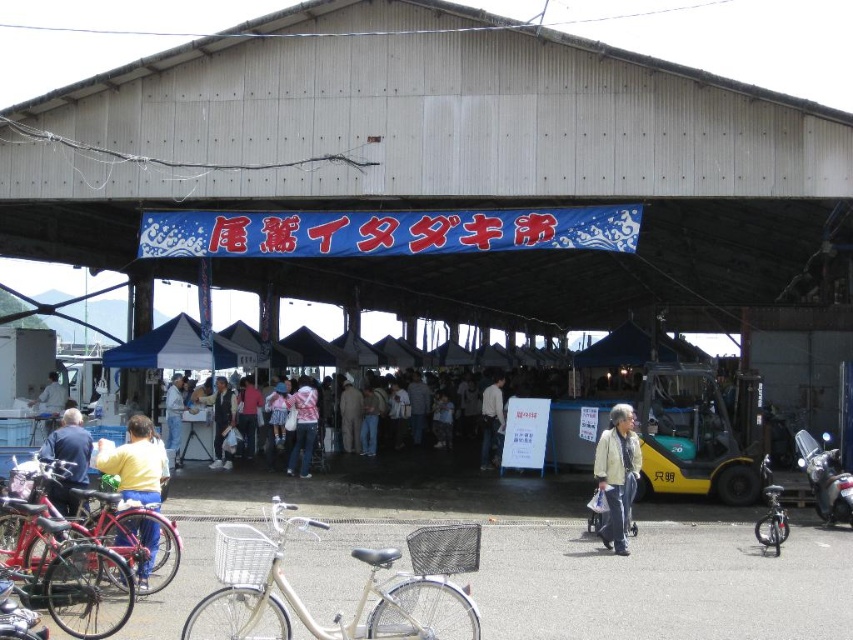
You are a photographer at the market and want to capture a candid shot of the blue denim jacket at center and khaki fabric pants at center. Since you want to focus on the jacket, which object should you ensure is in the foreground?

The blue denim jacket at center should be in the foreground because it is positioned over the khaki fabric pants at center, making it closer to the camera.

You are standing at point (x=201, y=364) and want to walk to the entrance of the market. However, there is an obstacle at point (x=309, y=472). Can you safely walk around the obstacle to reach your destination?

Point (x=201, y=364) is behind point (x=309, y=472), so you can walk around the obstacle at point (x=309, y=472) by moving to the side since it is in front of you.